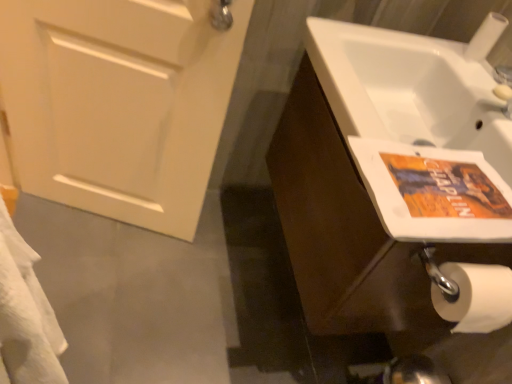
The height and width of the screenshot is (384, 512). Find the location of `empty space that is ontop of orange paper flyer at right (from a real-world perspective)`. empty space that is ontop of orange paper flyer at right (from a real-world perspective) is located at coordinates (447, 184).